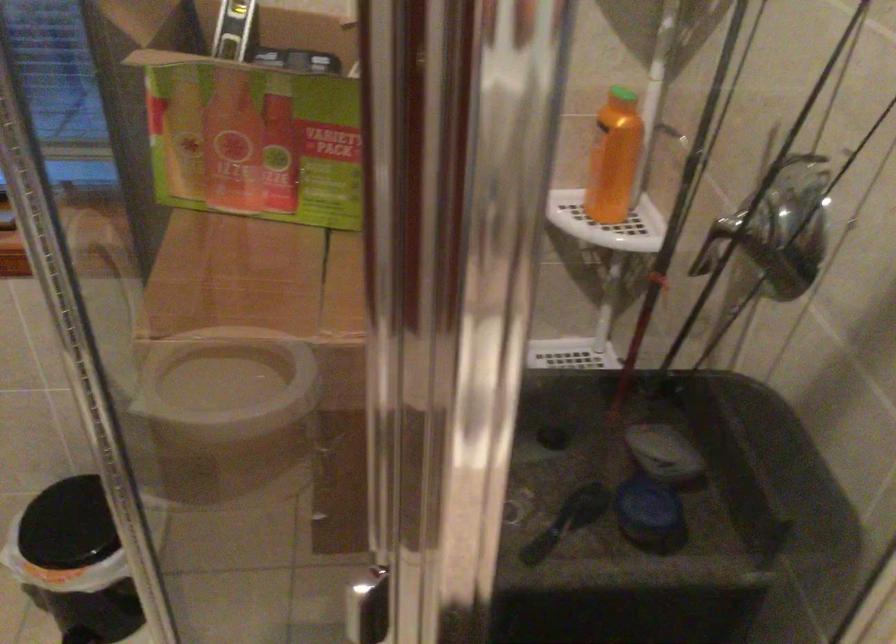
Where is `black fishing rod`? The height and width of the screenshot is (644, 896). black fishing rod is located at coordinates (676, 212).